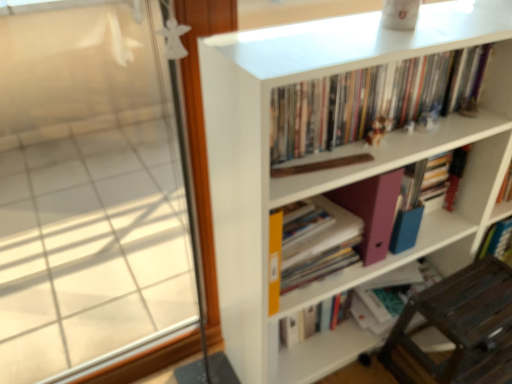
Describe the element at coordinates (319, 244) in the screenshot. I see `yellow matte folder at center, which is the third book from top to bottom` at that location.

What is the approximate height of hardcover books at upper center, which is the 1th book in top-to-bottom order?

hardcover books at upper center, which is the 1th book in top-to-bottom order, is 7.48 inches in height.

The height and width of the screenshot is (384, 512). What do you see at coordinates (88, 191) in the screenshot?
I see `transparent glass window at left` at bounding box center [88, 191].

This screenshot has height=384, width=512. Describe the element at coordinates (390, 295) in the screenshot. I see `matte pink folder at lower center, arranged as the first book when ordered from the bottom` at that location.

This screenshot has width=512, height=384. What are the coordinates of `yellow matte folder at center, marked as the 2th book in a bottom-to-top arrangement` in the screenshot? It's located at (319, 244).

Is the position of hardcover books at upper center, which is the 1th book in top-to-bottom order, less distant than that of white matte bookcase at upper right?

No, hardcover books at upper center, which is the 1th book in top-to-bottom order, is further to the viewer.

From the image's perspective, which object appears higher, hardcover books at upper center, which is the 1th book in top-to-bottom order, or white matte bookcase at upper right?

hardcover books at upper center, which is the 1th book in top-to-bottom order, is shown above in the image.

Could you tell me if hardcover books at upper center, which is the 1th book in top-to-bottom order, is turned towards white matte bookcase at upper right?

Yes.

From the image's perspective, is white matte bookcase at upper right positioned above or below brown wooden chair at lower right?

Clearly, from the image's perspective, white matte bookcase at upper right is above brown wooden chair at lower right.

Considering the points (257, 160) and (493, 284), which point is behind, point (257, 160) or point (493, 284)?

Point (493, 284)

Is white matte bookcase at upper right facing away from brown wooden chair at lower right?

white matte bookcase at upper right is not turned away from brown wooden chair at lower right.

At what (x,y) coordinates should I click in order to perform the action: click on bookcase above the brown wooden chair at lower right (from the image's perspective). Please return your answer as a coordinate pair (x, y). The height and width of the screenshot is (384, 512). Looking at the image, I should click on (335, 168).

Are hardcover books at upper center, which is the 1th book in top-to-bottom order, and matte pink folder at lower center, which is counted as the 4th book, starting from the top, beside each other?

There is a gap between hardcover books at upper center, which is the 1th book in top-to-bottom order, and matte pink folder at lower center, which is counted as the 4th book, starting from the top.

From the image's perspective, is hardcover books at upper center, which is the 1th book in top-to-bottom order, under matte pink folder at lower center, arranged as the first book when ordered from the bottom?

No.

Can we say hardcover books at upper center, which is the 1th book in top-to-bottom order, lies outside matte pink folder at lower center, which is counted as the 4th book, starting from the top?

Yes, hardcover books at upper center, which is the 1th book in top-to-bottom order, is located beyond the bounds of matte pink folder at lower center, which is counted as the 4th book, starting from the top.

Is transparent glass window at left positioned beyond the bounds of matte pink folder at lower center, which is counted as the 4th book, starting from the top?

Indeed, transparent glass window at left is completely outside matte pink folder at lower center, which is counted as the 4th book, starting from the top.

Are transparent glass window at left and matte pink folder at lower center, arranged as the first book when ordered from the bottom, beside each other?

No.

Could you tell me if transparent glass window at left is turned towards matte pink folder at lower center, arranged as the first book when ordered from the bottom?

No, transparent glass window at left does not turn towards matte pink folder at lower center, arranged as the first book when ordered from the bottom.

Between transparent glass window at left and matte pink folder at lower center, arranged as the first book when ordered from the bottom, which one has larger size?

Bigger between the two is transparent glass window at left.

Is matte pink folder at lower center, arranged as the first book when ordered from the bottom, turned away from matte pink folder at center?

No, matte pink folder at lower center, arranged as the first book when ordered from the bottom,'s orientation is not away from matte pink folder at center.

Consider the image. Who is shorter, matte pink folder at lower center, which is counted as the 4th book, starting from the top, or matte pink folder at center?

matte pink folder at lower center, which is counted as the 4th book, starting from the top.

In order to click on paperback book in front of the matte pink folder at lower center, arranged as the first book when ordered from the bottom in this screenshot , I will do [372, 211].

From the image's perspective, is white matte bookcase at upper right above hardcover books at upper center, which is the 1th book in top-to-bottom order?

No, from the image's perspective, white matte bookcase at upper right is not on top of hardcover books at upper center, which is the 1th book in top-to-bottom order.

From a real-world perspective, which is physically above, white matte bookcase at upper right or hardcover books at upper center, the 4th book ordered from the bottom?

hardcover books at upper center, the 4th book ordered from the bottom, from a real-world perspective.

From the picture: Considering the positions of objects white matte bookcase at upper right and hardcover books at upper center, which is the 1th book in top-to-bottom order, in the image provided, who is behind, white matte bookcase at upper right or hardcover books at upper center, which is the 1th book in top-to-bottom order,?

hardcover books at upper center, which is the 1th book in top-to-bottom order.

Considering the points (355, 36) and (340, 136), which point is behind, point (355, 36) or point (340, 136)?

Positioned behind is point (340, 136).

Is matte pink folder at center at the back of hardcover book at center, which is counted as the second book, starting from the top?

No, hardcover book at center, which is counted as the second book, starting from the top, is not facing the opposite direction of matte pink folder at center.

From a real-world perspective, who is located lower, hardcover book at center, which is counted as the second book, starting from the top, or matte pink folder at center?

From a 3D spatial view, hardcover book at center, which is counted as the second book, starting from the top, is below.

From the matte pink folder at center, count 3rd book to the right and point to it. Please provide its 2D coordinates.

[(455, 175)]

How much distance is there between hardcover book at center, which is counted as the second book, starting from the top, and matte pink folder at center?

They are 37.58 centimeters apart.

Where is `bookcase that appears below the hardcover books at upper center, the 4th book ordered from the bottom (from a real-world perspective)`? The width and height of the screenshot is (512, 384). bookcase that appears below the hardcover books at upper center, the 4th book ordered from the bottom (from a real-world perspective) is located at coordinates (335, 168).

Where is `bookcase in front of the brown wooden chair at lower right`? bookcase in front of the brown wooden chair at lower right is located at coordinates (335, 168).

Based on their spatial positions, is matte pink folder at lower center, which is counted as the 4th book, starting from the top, or yellow matte folder at center, marked as the 2th book in a bottom-to-top arrangement, further from hardcover book at center, which is counted as the second book, starting from the top?

yellow matte folder at center, marked as the 2th book in a bottom-to-top arrangement, is positioned further to the anchor hardcover book at center, which is counted as the second book, starting from the top.

Estimate the real-world distances between objects in this image. Which object is further from brown wooden chair at lower right, hardcover books at upper center, the 4th book ordered from the bottom, or yellow matte folder at center, marked as the 2th book in a bottom-to-top arrangement?

hardcover books at upper center, the 4th book ordered from the bottom.

From the picture: Based on their spatial positions, is hardcover book at center, which is counted as the second book, starting from the top, or matte pink folder at lower center, arranged as the first book when ordered from the bottom, closer to brown wooden chair at lower right?

matte pink folder at lower center, arranged as the first book when ordered from the bottom, is positioned closer to the anchor brown wooden chair at lower right.

Looking at the image, which one is located further to hardcover book at center, the 3th book when ordered from bottom to top, transparent glass window at left or matte pink folder at center?

Based on the image, transparent glass window at left appears to be further to hardcover book at center, the 3th book when ordered from bottom to top.

Based on their spatial positions, is transparent glass window at left or matte pink folder at lower center, arranged as the first book when ordered from the bottom, further from hardcover books at upper center, which is the 1th book in top-to-bottom order?

transparent glass window at left is positioned further to the anchor hardcover books at upper center, which is the 1th book in top-to-bottom order.

Estimate the real-world distances between objects in this image. Which object is closer to transparent glass window at left, yellow matte folder at center, which is the third book from top to bottom, or white matte bookcase at upper right?

Among the two, white matte bookcase at upper right is located nearer to transparent glass window at left.

Estimate the real-world distances between objects in this image. Which object is further from hardcover books at upper center, which is the 1th book in top-to-bottom order, matte pink folder at lower center, which is counted as the 4th book, starting from the top, or brown wooden chair at lower right?

The object further to hardcover books at upper center, which is the 1th book in top-to-bottom order, is matte pink folder at lower center, which is counted as the 4th book, starting from the top.

Which object lies further to the anchor point yellow matte folder at center, marked as the 2th book in a bottom-to-top arrangement, hardcover books at upper center, the 4th book ordered from the bottom, or hardcover book at center, the 3th book when ordered from bottom to top?

hardcover book at center, the 3th book when ordered from bottom to top, is further to yellow matte folder at center, marked as the 2th book in a bottom-to-top arrangement.

Find the location of a particular element. Image resolution: width=512 pixels, height=384 pixels. paperback book situated between transparent glass window at left and brown wooden chair at lower right from left to right is located at coordinates [372, 211].

Identify the location of bookcase between hardcover book at center, which is counted as the second book, starting from the top, and brown wooden chair at lower right vertically. The height and width of the screenshot is (384, 512). (335, 168).

Where is `paperback book positioned between white matte bookcase at upper right and yellow matte folder at center, which is the third book from top to bottom, from near to far`? This screenshot has height=384, width=512. paperback book positioned between white matte bookcase at upper right and yellow matte folder at center, which is the third book from top to bottom, from near to far is located at coordinates (372, 211).

Identify the location of book between white matte bookcase at upper right and matte pink folder at center along the z-axis. (370, 100).